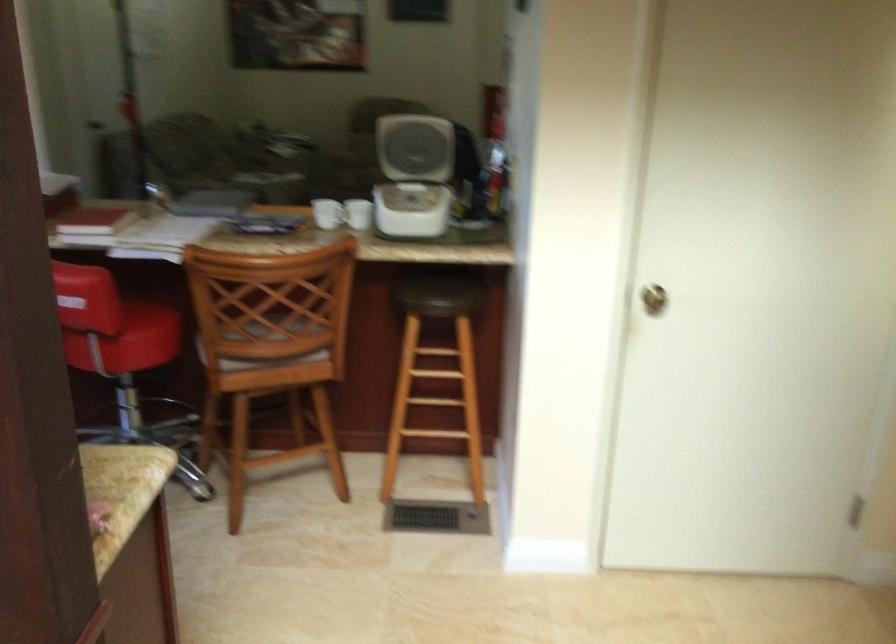
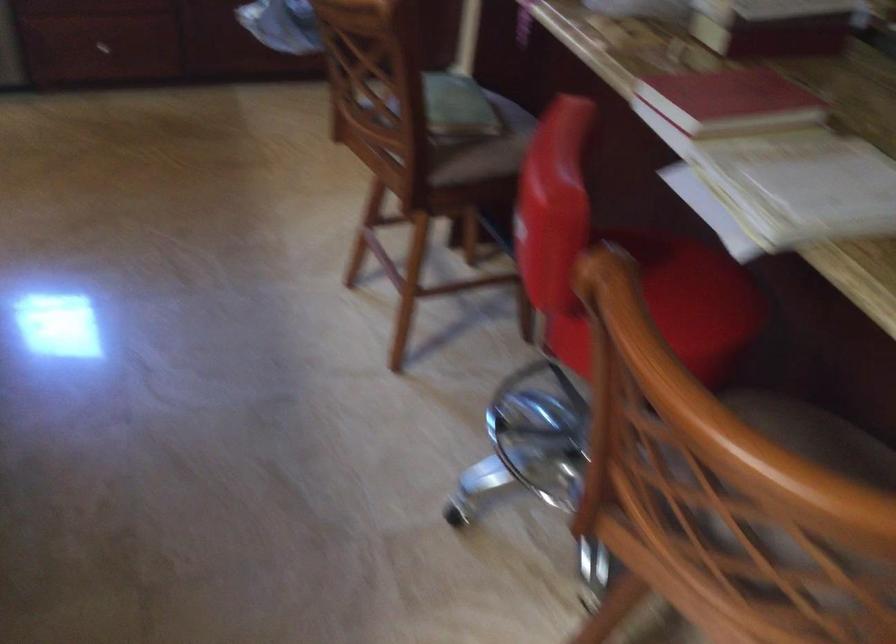
Question: I am providing you with two images of the same scene from different viewpoints. After the viewpoint changes to image2, which objects are now occluded?

Choices:
 (A) silver drawer handle
 (B) red chair sitting surface
 (C) bottle with red label
 (D) wooden chair sitting surface

Answer: (B)